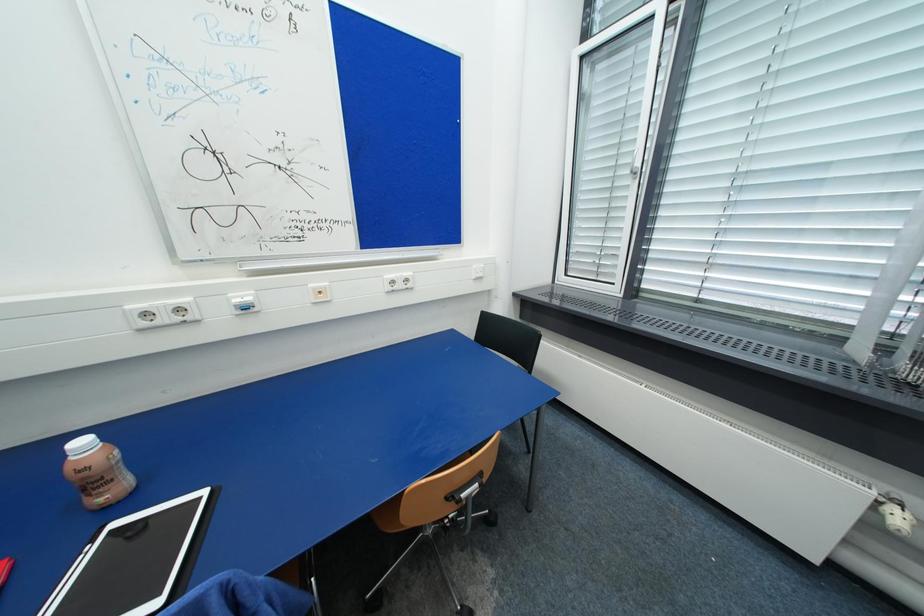
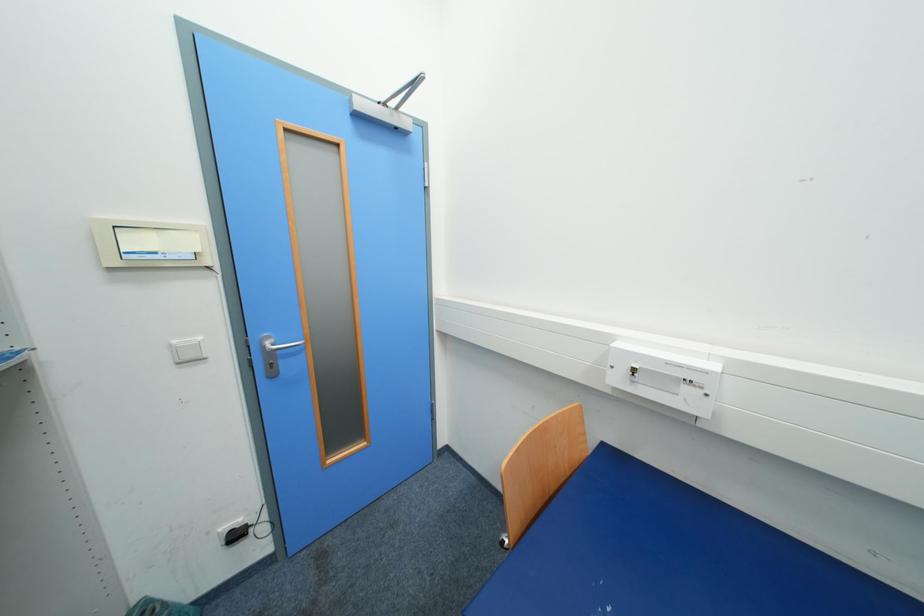
Question: Based on the continuous images, in which direction is the camera rotating? Reply with the corresponding letter.

Choices:
 (A) Left
 (B) Right
 (C) Up
 (D) Down

Answer: (A)